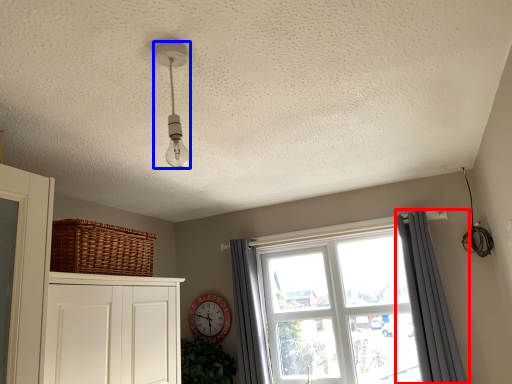
Question: Which object is further to the camera taking this photo, curtain (highlighted by a red box) or light fixture (highlighted by a blue box)?

Choices:
 (A) curtain
 (B) light fixture

Answer: (A)